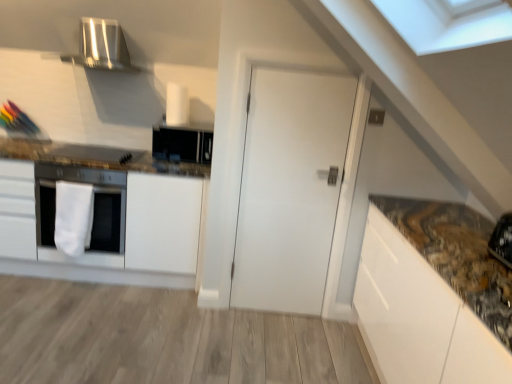
Question: Considering the relative positions of white matte cabinet at left and black matte microwave at upper center in the image provided, is white matte cabinet at left to the left of black matte microwave at upper center from the viewer's perspective?

Choices:
 (A) no
 (B) yes

Answer: (B)

Question: Are white matte cabinet at left and black matte microwave at upper center located far from each other?

Choices:
 (A) yes
 (B) no

Answer: (B)

Question: Is white matte cabinet at left touching black matte microwave at upper center?

Choices:
 (A) yes
 (B) no

Answer: (B)

Question: Is white matte cabinet at left surrounding black matte microwave at upper center?

Choices:
 (A) no
 (B) yes

Answer: (A)

Question: From the image's perspective, is white matte cabinet at left located above black matte microwave at upper center?

Choices:
 (A) yes
 (B) no

Answer: (B)

Question: Is white matte cabinet at left located outside black matte microwave at upper center?

Choices:
 (A) yes
 (B) no

Answer: (A)

Question: Considering the relative sizes of white matte door at center and satin silver exhaust hood at upper left in the image provided, is white matte door at center bigger than satin silver exhaust hood at upper left?

Choices:
 (A) no
 (B) yes

Answer: (A)

Question: Is white matte door at center directly adjacent to satin silver exhaust hood at upper left?

Choices:
 (A) no
 (B) yes

Answer: (A)

Question: Is white matte door at center located outside satin silver exhaust hood at upper left?

Choices:
 (A) yes
 (B) no

Answer: (A)

Question: Is white matte door at center further to camera compared to satin silver exhaust hood at upper left?

Choices:
 (A) no
 (B) yes

Answer: (A)

Question: Are white matte door at center and satin silver exhaust hood at upper left located far from each other?

Choices:
 (A) yes
 (B) no

Answer: (A)

Question: Is white matte door at center facing away from satin silver exhaust hood at upper left?

Choices:
 (A) no
 (B) yes

Answer: (A)

Question: Is white matte oven at left to the right of white matte door at center from the viewer's perspective?

Choices:
 (A) no
 (B) yes

Answer: (A)